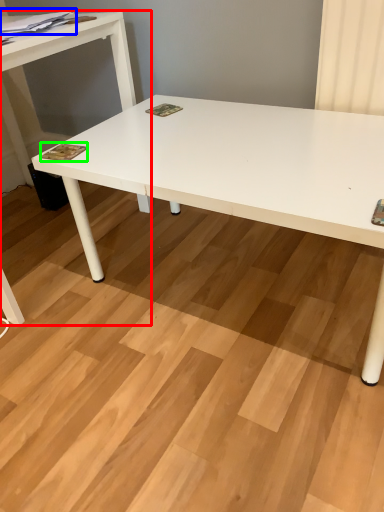
Question: Which is nearer to the table (highlighted by a red box)? magazine (highlighted by a blue box) or magazine (highlighted by a green box).

Choices:
 (A) magazine
 (B) magazine

Answer: (A)